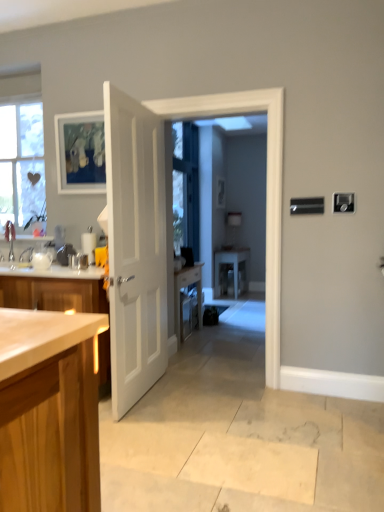
Question: Can you confirm if matte wooden picture frame at upper left is thinner than white glossy door at center?

Choices:
 (A) yes
 (B) no

Answer: (A)

Question: From a real-world perspective, is matte wooden picture frame at upper left on white glossy door at center?

Choices:
 (A) yes
 (B) no

Answer: (A)

Question: Considering the relative sizes of matte wooden picture frame at upper left and white glossy door at center in the image provided, is matte wooden picture frame at upper left wider than white glossy door at center?

Choices:
 (A) yes
 (B) no

Answer: (B)

Question: Is matte wooden picture frame at upper left shorter than white glossy door at center?

Choices:
 (A) no
 (B) yes

Answer: (B)

Question: Could white glossy door at center be considered to be inside matte wooden picture frame at upper left?

Choices:
 (A) no
 (B) yes

Answer: (A)

Question: Is matte wooden picture frame at upper left inside or outside of clear glass window screen at center?

Choices:
 (A) outside
 (B) inside

Answer: (A)

Question: From the image's perspective, is matte wooden picture frame at upper left above or below clear glass window screen at center?

Choices:
 (A) above
 (B) below

Answer: (B)

Question: Looking at their shapes, would you say matte wooden picture frame at upper left is wider or thinner than clear glass window screen at center?

Choices:
 (A) thin
 (B) wide

Answer: (A)

Question: Considering the relative positions of matte wooden picture frame at upper left and clear glass window screen at center in the image provided, is matte wooden picture frame at upper left to the left or to the right of clear glass window screen at center?

Choices:
 (A) right
 (B) left

Answer: (B)

Question: Is clear glass window screen at center wider or thinner than white glossy door at center?

Choices:
 (A) thin
 (B) wide

Answer: (A)

Question: From a real-world perspective, is clear glass window screen at center positioned above or below white glossy door at center?

Choices:
 (A) above
 (B) below

Answer: (A)

Question: In terms of height, does clear glass window screen at center look taller or shorter compared to white glossy door at center?

Choices:
 (A) tall
 (B) short

Answer: (B)

Question: Is point (190, 143) positioned closer to the camera than point (273, 285)?

Choices:
 (A) closer
 (B) farther

Answer: (B)

Question: Looking at the image, does clear glass window screen at center seem bigger or smaller compared to white glossy table at center?

Choices:
 (A) big
 (B) small

Answer: (A)

Question: Considering the positions of clear glass window screen at center and white glossy table at center in the image, is clear glass window screen at center wider or thinner than white glossy table at center?

Choices:
 (A) wide
 (B) thin

Answer: (B)